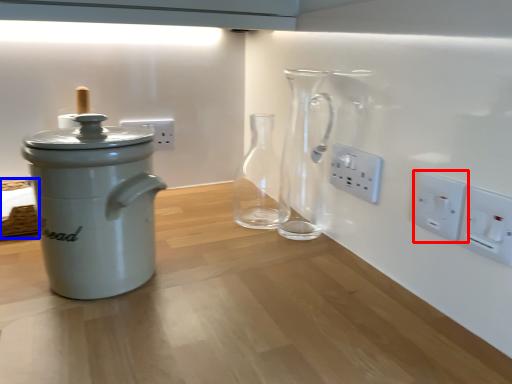
Question: Which point is closer to the camera, electric outlet (highlighted by a red box) or basket (highlighted by a blue box)?

Choices:
 (A) electric outlet
 (B) basket

Answer: (A)